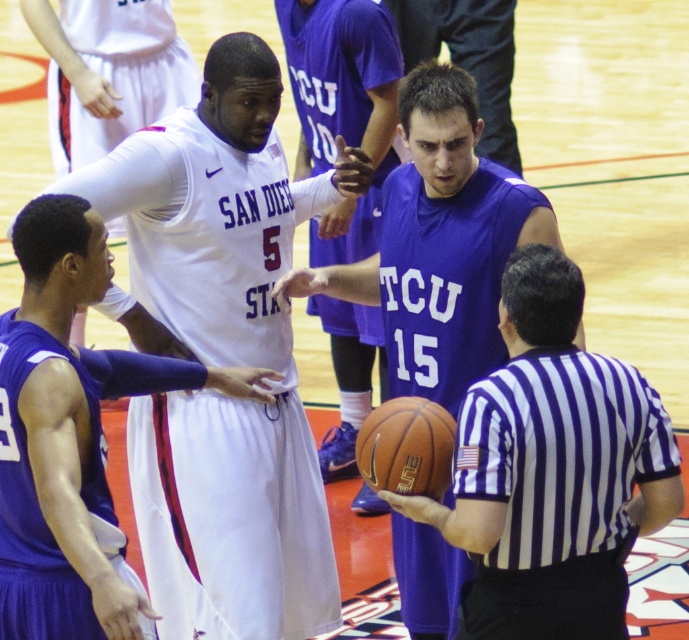
You are a spectator at the basketball game. You notice two teams playing. The purple jersey at center and the white jersey at center are both visible. Which team member is closer to you, the spectator?

The purple jersey at center is closer to you because it is in front of the white jersey at center.

You are standing at the point marked as point (404, 572) in the basketball court. A ball is thrown from your position towards the referee who is 5.99 meters away. Will the ball reach the referee before it hits the ground?

The point (404, 572) and viewer are 5.99 meters apart. Since the ball is thrown towards the referee who is exactly 5.99 meters away, if the throw has sufficient arc or force, the ball could reach the referee before hitting the ground. However, without knowing the angle or velocity, we can only confirm the distance is possible.